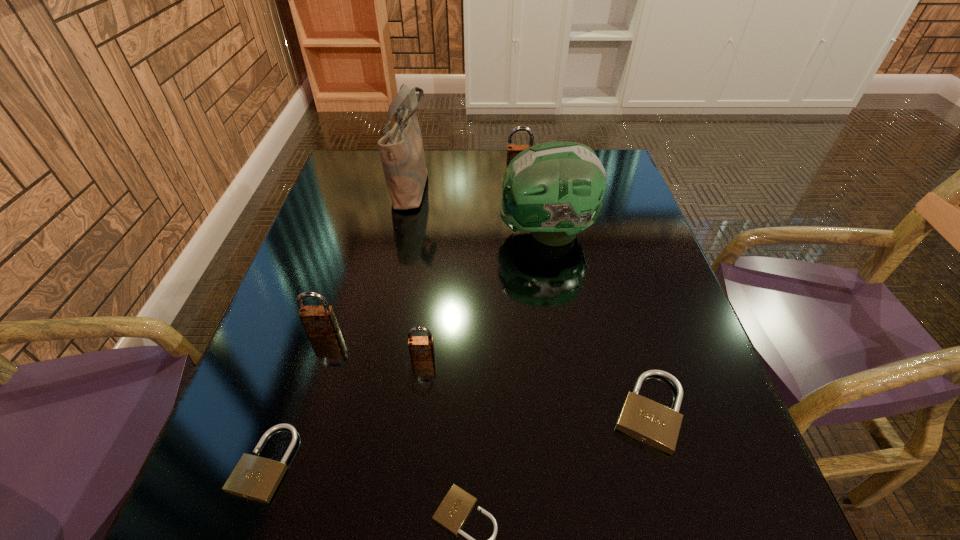
The height and width of the screenshot is (540, 960). In order to click on vacant area located on the front-facing side of the fourth nearest object in this screenshot , I will do `click(420, 389)`.

What are the coordinates of `vacant region located 0.330m on the left of the biggest beige padlock` in the screenshot? It's located at (421, 411).

This screenshot has width=960, height=540. In order to click on free space located on the right of the leftmost beige padlock in this screenshot , I will do `click(498, 462)`.

Where is `shoulder bag that is positioned at the far edge`? The width and height of the screenshot is (960, 540). shoulder bag that is positioned at the far edge is located at coordinates (402, 154).

Find the location of a particular element. padlock situated at the far edge is located at coordinates (512, 150).

In order to click on object present at the near edge in this screenshot , I will do `click(256, 478)`.

The width and height of the screenshot is (960, 540). What are the coordinates of `football helmet present at the right edge` in the screenshot? It's located at (554, 190).

Locate an element on the screen. padlock that is at the right edge is located at coordinates pos(652,423).

Identify the location of object that is at the near left corner. (256, 478).

In the image, there is a desktop. Identify the location of vacant space at the far edge. Image resolution: width=960 pixels, height=540 pixels. (429, 152).